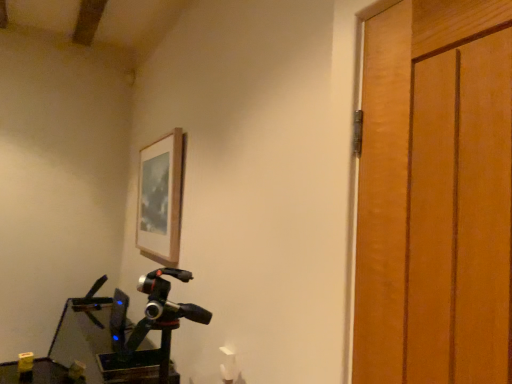
Question: Looking at their shapes, would you say wooden picture frame at upper center is wider or thinner than metallic green workbench at lower left?

Choices:
 (A) wide
 (B) thin

Answer: (B)

Question: In terms of height, does wooden picture frame at upper center look taller or shorter compared to metallic green workbench at lower left?

Choices:
 (A) tall
 (B) short

Answer: (B)

Question: Relative to metallic green workbench at lower left, is wooden picture frame at upper center in front or behind?

Choices:
 (A) behind
 (B) front

Answer: (A)

Question: Based on their positions, is metallic green workbench at lower left located to the left or right of wooden picture frame at upper center?

Choices:
 (A) left
 (B) right

Answer: (A)

Question: From the image's perspective, is metallic green workbench at lower left located above or below wooden picture frame at upper center?

Choices:
 (A) below
 (B) above

Answer: (A)

Question: In terms of height, does metallic green workbench at lower left look taller or shorter compared to wooden picture frame at upper center?

Choices:
 (A) tall
 (B) short

Answer: (A)

Question: Looking at their shapes, would you say metallic green workbench at lower left is wider or thinner than wooden picture frame at upper center?

Choices:
 (A) wide
 (B) thin

Answer: (A)